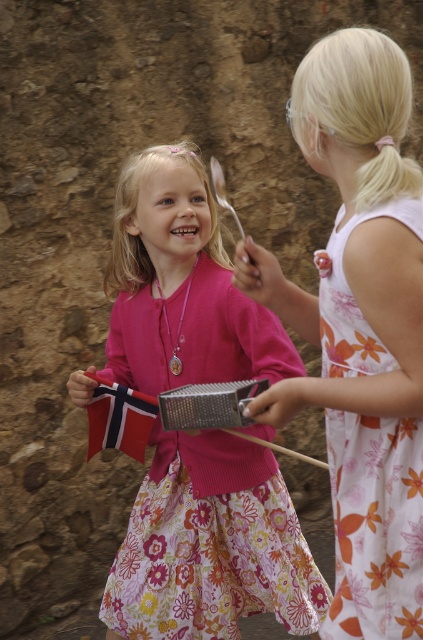
You are a photographer trying to capture the two girls in the scene. You want to ensure that both the floral dress at center and the floral cotton dress at right are clearly visible in your shot. Based on their positions, which dress should you focus on first to ensure it doesn

The floral dress at center is located above the floral cotton dress at right, so you should focus on the floral cotton dress at right first since it is lower and might be partially obscured if not properly framed.

You are a photographer trying to capture the perfect shot of the scene. You want to focus on the pink matte sweater at center. Based on its position, which girl is wearing it?

The pink matte sweater at center is located at point (211, 545), which places it on the girl on the left wearing the vibrant pink cardigan over a floral dress.

You are a photographer standing in front of the two girls. You want to take a photo of both the pink matte sweater at center and the floral cotton dress at right. Can you fit both into your camera frame if the maximum distance your camera can capture is 28 inches?

The pink matte sweater at center and the floral cotton dress at right are 28.03 inches apart. Since the camera can only capture up to 28 inches, the distance between them is slightly too far to fit both into the frame.